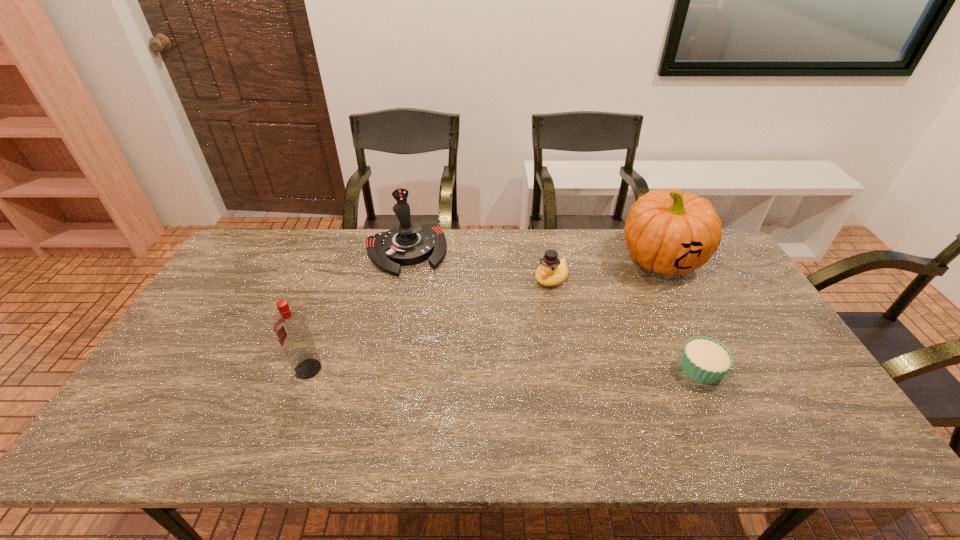
The width and height of the screenshot is (960, 540). Find the location of `free space located 0.390m on the handle side of the fourth object from right to left`. free space located 0.390m on the handle side of the fourth object from right to left is located at coordinates (446, 368).

Image resolution: width=960 pixels, height=540 pixels. I want to click on vacant space located on the handle side of the fourth object from right to left, so click(x=441, y=350).

You are a GUI agent. You are given a task and a screenshot of the screen. Output one action in this format:
    pyautogui.click(x=<x>, y=<y>)
    Task: Click on the blank space located on the handle side of the fourth object from right to left
    This screenshot has height=540, width=960.
    Given the screenshot: What is the action you would take?
    point(430,320)

Image resolution: width=960 pixels, height=540 pixels. In order to click on free space located 0.070m on the front-facing side of the duck in this screenshot , I will do `click(528, 299)`.

At what (x,y) coordinates should I click in order to perform the action: click on free spot located on the front-facing side of the duck. Please return your answer as a coordinate pair (x, y). The height and width of the screenshot is (540, 960). Looking at the image, I should click on (491, 332).

This screenshot has height=540, width=960. What are the coordinates of `vacant space located on the front-facing side of the duck` in the screenshot? It's located at (494, 328).

The width and height of the screenshot is (960, 540). I want to click on vacant point located 0.360m on the surface of the pumpkin, so click(585, 346).

Find the location of `free space located 0.280m on the surface of the pumpkin`. free space located 0.280m on the surface of the pumpkin is located at coordinates (599, 329).

Locate an element on the screen. vacant space located on the surface of the pumpkin is located at coordinates (624, 302).

This screenshot has width=960, height=540. In order to click on joystick at the far edge in this screenshot , I will do `click(410, 243)`.